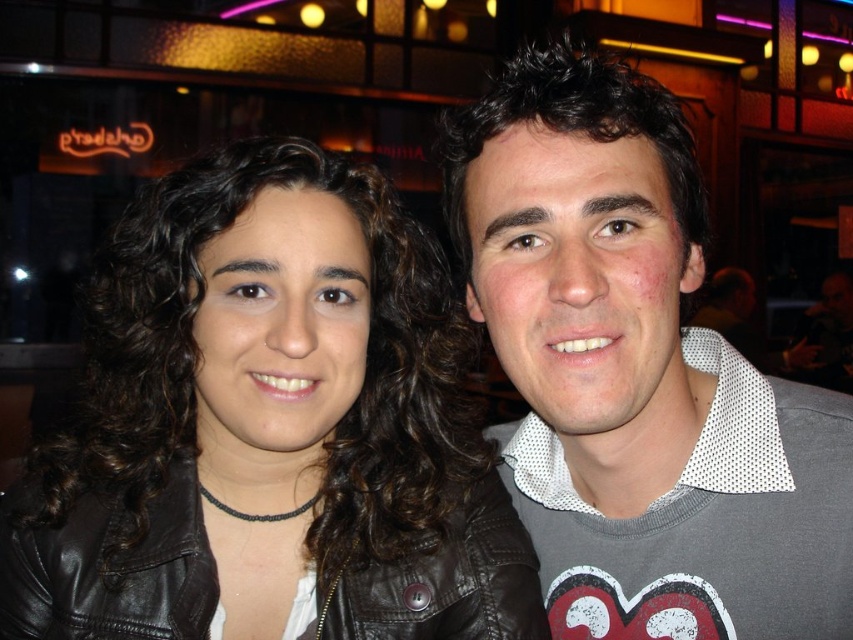
You are a photographer adjusting your camera settings to focus on two specific points in the scene. The first point is at coordinates point (42, 483) and the second is at point (523, 636). Which point should you focus on first if you want to ensure the closest object is in sharp focus?

Point (42, 483) is further to the viewer than point (523, 636), so you should focus on point (42, 483) first to ensure the closest object is in sharp focus.

You are a photographer trying to focus on the black leather jacket at upper left. You notice a point at coordinates (268,429). Is this point located on the black leather jacket at upper left?

Yes, the point at coordinates (268,429) is on the black leather jacket at upper left according to the description.

You are a photographer trying to adjust the lighting for a photo shoot. You notice the black leather jacket at upper left and the gray mesh shirt at center. Which object is positioned more to the left side of the image?

The black leather jacket at upper left is positioned more to the left side of the image than the gray mesh shirt at center.